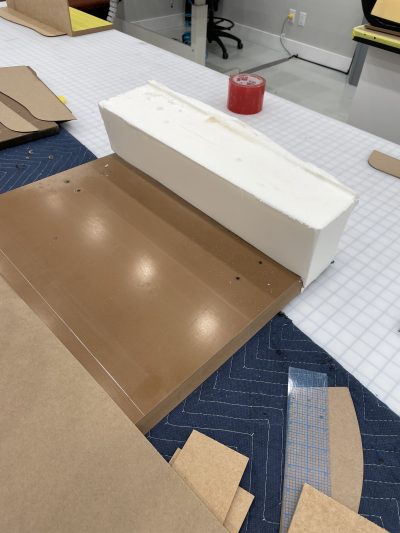
The height and width of the screenshot is (533, 400). In order to click on electrical outlets in this screenshot , I will do `click(290, 13)`, `click(302, 17)`.